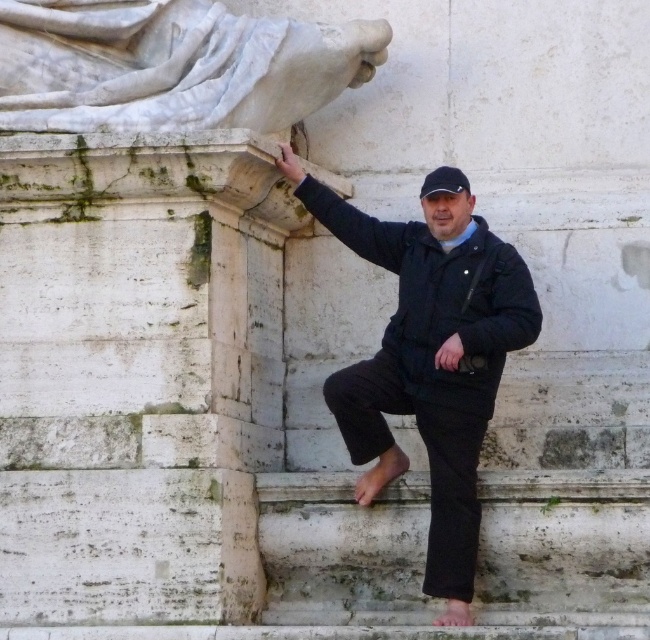
You are a photographer trying to capture both the white marble statue at upper left and the black fabric baseball hat at upper center in the same frame. Based on their sizes, which object should you focus on first to ensure both are in the frame?

The white marble statue at upper left is bigger than the black fabric baseball hat at upper center, so you should focus on the white marble statue at upper left first to ensure both fit in the frame.

You are a photographer trying to capture both the black matte jacket at center and the white marble statue at upper left in the same frame. Which object should you focus on first to ensure both are in focus?

You should focus on the black matte jacket at center first because it is closer to the viewer than the white marble statue at upper left. By focusing on the closer object, the statue will also be in focus due to the depth of field.

You are a photographer trying to capture a shot of the black fabric baseball hat at upper center and the white marble statue at upper left. Which object should you focus on first if you want to include both in your frame without moving the camera?

The white marble statue at upper left is to the left of the black fabric baseball hat at upper center, so you should focus on the white marble statue at upper left first to ensure both are in frame.